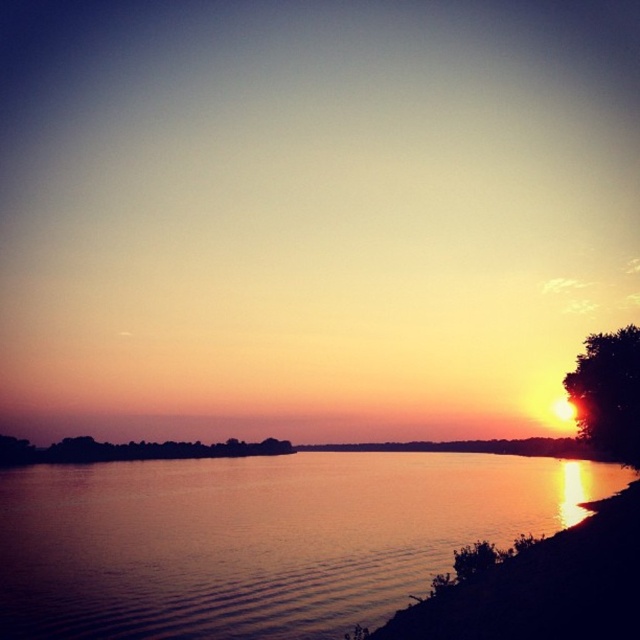
You are standing on the bank of the lake and want to take a photo of the green leafy tree at lower left without the silky water at center appearing in the foreground. Is this possible given their positions?

The silky water at center is positioned over the green leafy tree at lower left, meaning the water is in front of the tree from your perspective. Therefore, it would be challenging to capture the tree without the water appearing in the foreground.

You are standing on the bank of the lake and want to reach the point marked at coordinates point (x=385, y=515). Given that the water is calm and the reflection is clear, can you estimate how far you need to walk to reach that point?

The point (x=385, y=515) is 55.06 meters away from the viewer, so you need to walk approximately 55.06 meters to reach it.